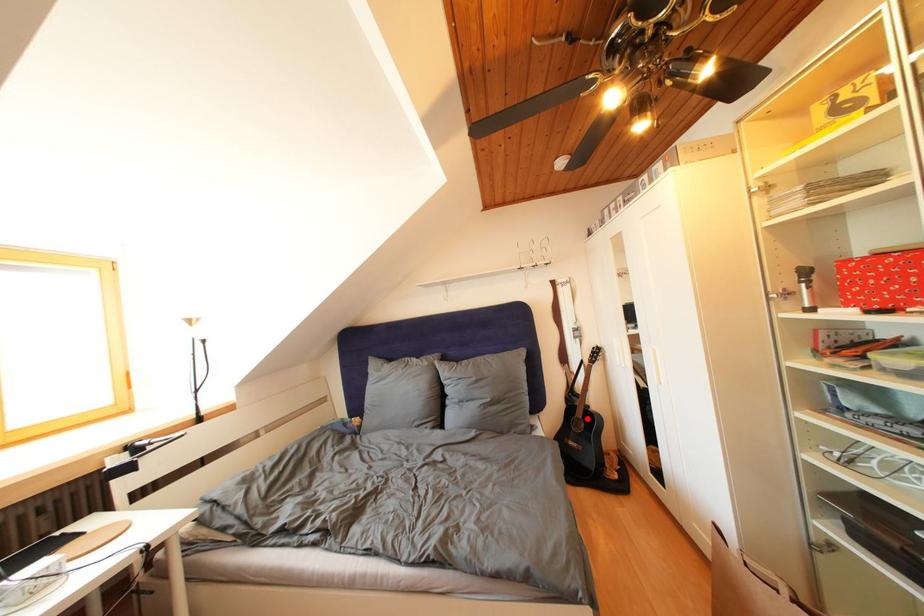
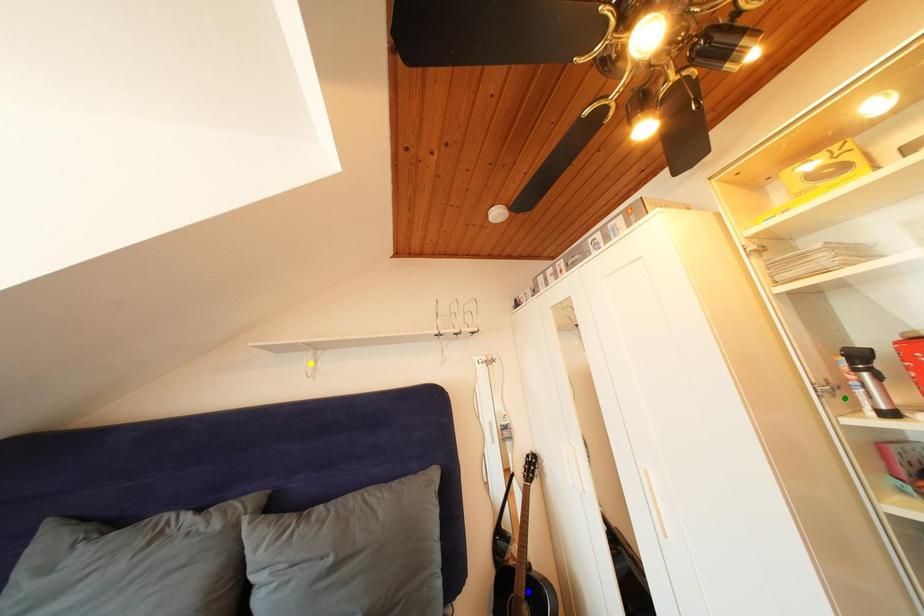
Question: I am providing you with two images of the same scene from different viewpoints. A red point is marked on the first image. You are given multiple points on the second image. Can you choose the point in image 2 that corresponds to the point in image 1?

Choices:
 (A) green point
 (B) blue point
 (C) yellow point

Answer: (B)